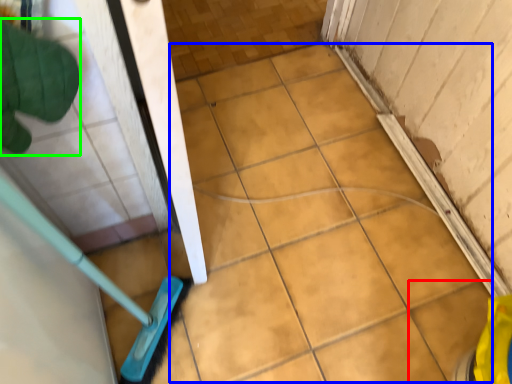
Question: Considering the real-world distances, which object is farthest from ceramic tile (highlighted by a red box)? ceramic tile (highlighted by a blue box) or hand (highlighted by a green box)?

Choices:
 (A) ceramic tile
 (B) hand

Answer: (B)